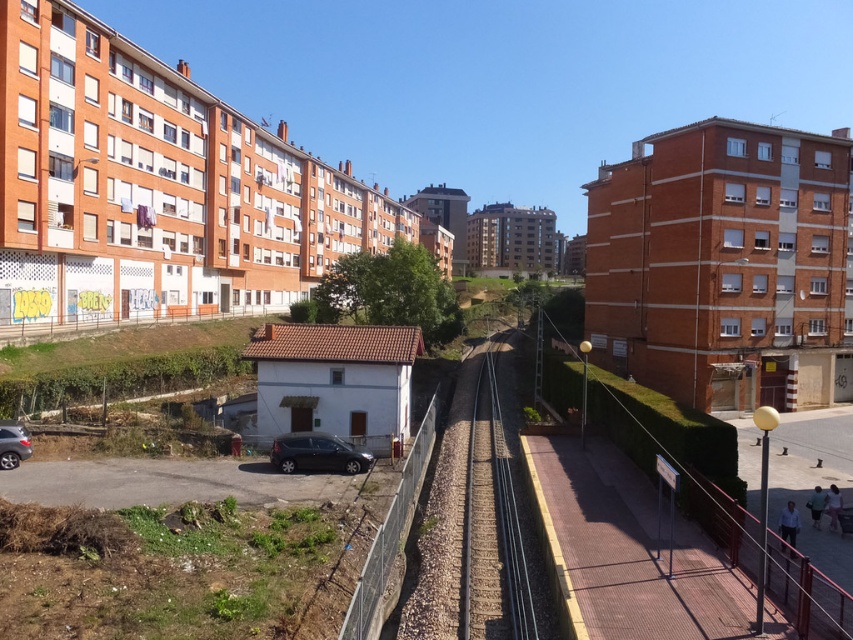
Between brown gravel train track at center and matte black car at lower left, which one appears on the right side from the viewer's perspective?

From the viewer's perspective, brown gravel train track at center appears more on the right side.

Which is in front, point (465, 637) or point (15, 426)?

Point (465, 637) is in front.

Which is behind, point (511, 568) or point (12, 429)?

The point (12, 429) is more distant.

This screenshot has width=853, height=640. In order to click on brown gravel train track at center in this screenshot , I will do `click(492, 525)`.

Can you confirm if satin black car at lower center is taller than matte black car at lower left?

No, satin black car at lower center is not taller than matte black car at lower left.

Is satin black car at lower center to the right of matte black car at lower left from the viewer's perspective?

Correct, you'll find satin black car at lower center to the right of matte black car at lower left.

Find the location of a particular element. satin black car at lower center is located at coordinates (317, 452).

What do you see at coordinates (492, 525) in the screenshot?
I see `brown gravel train track at center` at bounding box center [492, 525].

Can you confirm if brown gravel train track at center is positioned above satin black car at lower center?

No, brown gravel train track at center is not above satin black car at lower center.

The image size is (853, 640). What do you see at coordinates (492, 525) in the screenshot?
I see `brown gravel train track at center` at bounding box center [492, 525].

The height and width of the screenshot is (640, 853). Find the location of `brown gravel train track at center`. brown gravel train track at center is located at coordinates (492, 525).